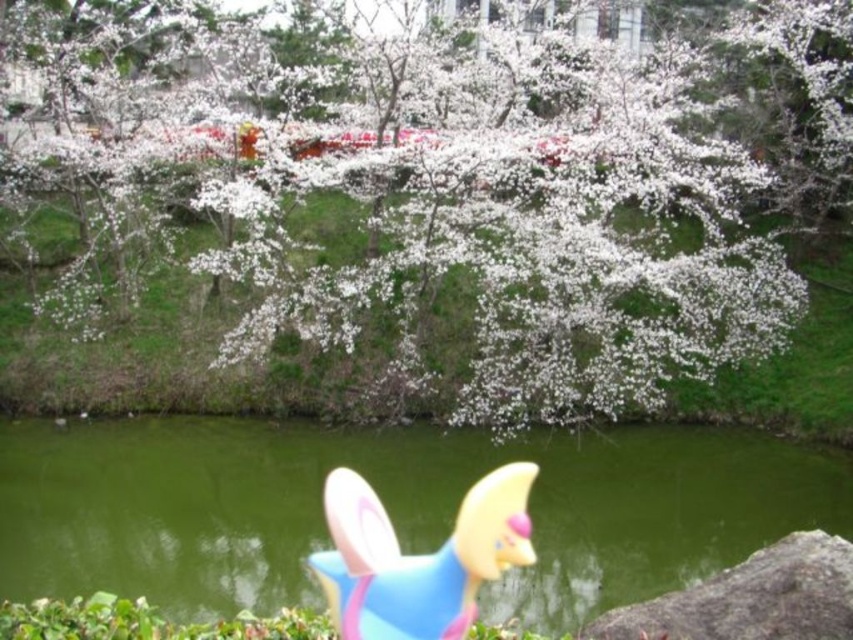
Question: Is white matte tree at upper center bigger than green glossy water at lower center?

Choices:
 (A) yes
 (B) no

Answer: (A)

Question: Which point is farther to the camera?

Choices:
 (A) white matte tree at upper center
 (B) blue rubber toy at lower center

Answer: (A)

Question: Which object is closer to the camera taking this photo?

Choices:
 (A) gray rough stone at lower right
 (B) green glossy water at lower center
 (C) blue rubber toy at lower center

Answer: (C)

Question: Can you confirm if white matte tree at upper center is bigger than blue rubber toy at lower center?

Choices:
 (A) yes
 (B) no

Answer: (A)

Question: Which point is closer to the camera taking this photo?

Choices:
 (A) (814, 616)
 (B) (473, 515)
 (C) (158, 552)
 (D) (405, 212)

Answer: (B)

Question: Does blue rubber toy at lower center appear on the right side of gray rough stone at lower right?

Choices:
 (A) no
 (B) yes

Answer: (A)